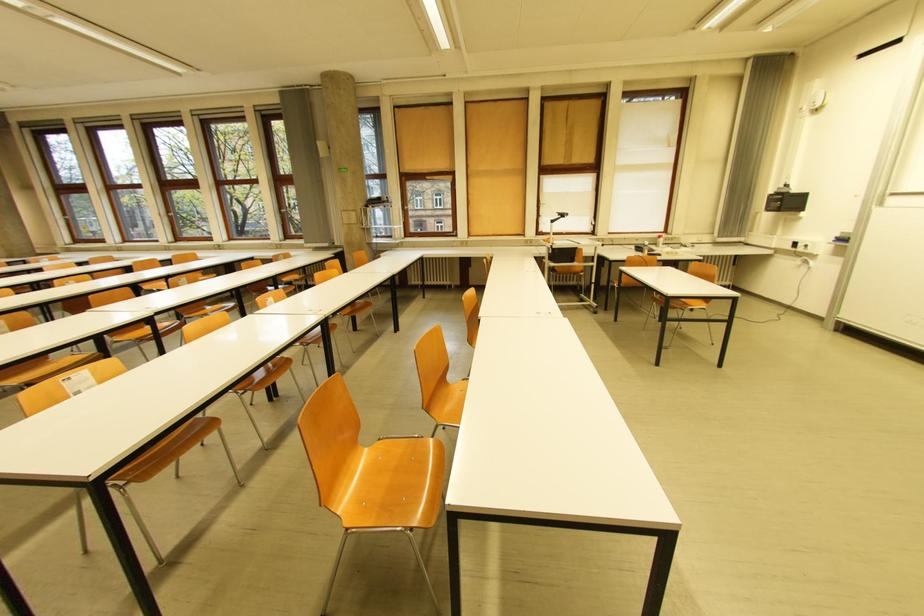
Which object does [646,160] point to?

It corresponds to the white window shade in the image.